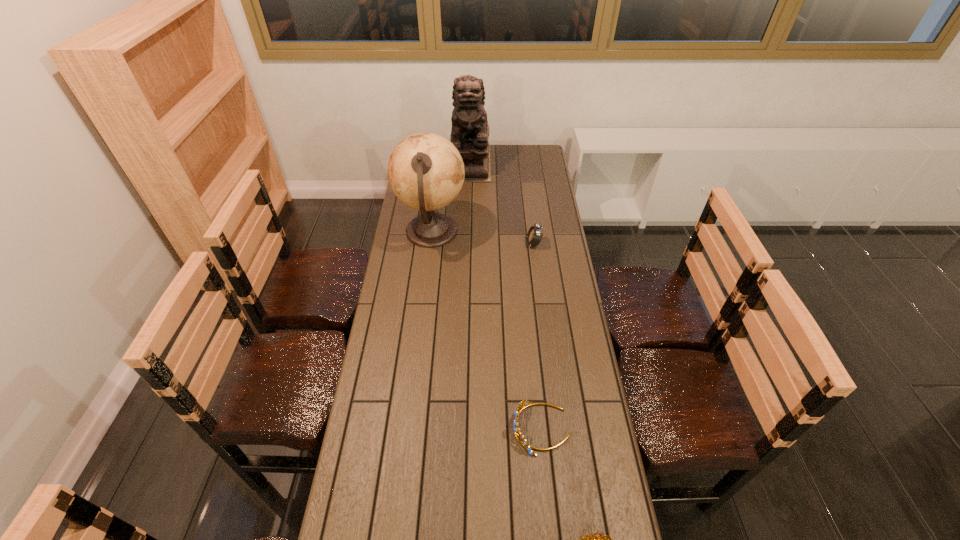
Where is `vacant space that is in between the sculpture and the alarm clock`? vacant space that is in between the sculpture and the alarm clock is located at coordinates (502, 204).

This screenshot has height=540, width=960. Identify the location of empty space that is in between the alarm clock and the farthest object. (502, 204).

You are a GUI agent. You are given a task and a screenshot of the screen. Output one action in this format:
    pyautogui.click(x=<x>, y=<y>)
    Task: Click on the vacant space in between the alarm clock and the sculpture
    The image size is (960, 540).
    Given the screenshot: What is the action you would take?
    pyautogui.click(x=502, y=204)

Select which object appears as the third closest to the farthest object. Please provide its 2D coordinates. Your answer should be formatted as a tuple, i.e. [(x, y)], where the tuple contains the x and y coordinates of a point satisfying the conditions above.

[(524, 403)]

Locate an element on the screen. The height and width of the screenshot is (540, 960). object that ranks as the fourth closest to the nearest object is located at coordinates (470, 131).

What are the coordinates of `vacant point that satisfies the following two spatial constraints: 1. on the front-facing side of the farthest object; 2. on the front-facing side of the globe` in the screenshot? It's located at (468, 232).

You are a GUI agent. You are given a task and a screenshot of the screen. Output one action in this format:
    pyautogui.click(x=<x>, y=<y>)
    Task: Click on the vacant point that satisfies the following two spatial constraints: 1. on the front-facing side of the sculpture; 2. on the front-facing side of the globe
    
    Given the screenshot: What is the action you would take?
    pyautogui.click(x=468, y=232)

Where is `free spot that satisfies the following two spatial constraints: 1. on the front-facing side of the farthest object; 2. on the front-facing side of the globe`? The height and width of the screenshot is (540, 960). free spot that satisfies the following two spatial constraints: 1. on the front-facing side of the farthest object; 2. on the front-facing side of the globe is located at coordinates (468, 232).

Find the location of a particular element. The height and width of the screenshot is (540, 960). free space that satisfies the following two spatial constraints: 1. on the front-facing side of the sculpture; 2. on the front-facing side of the globe is located at coordinates (468, 232).